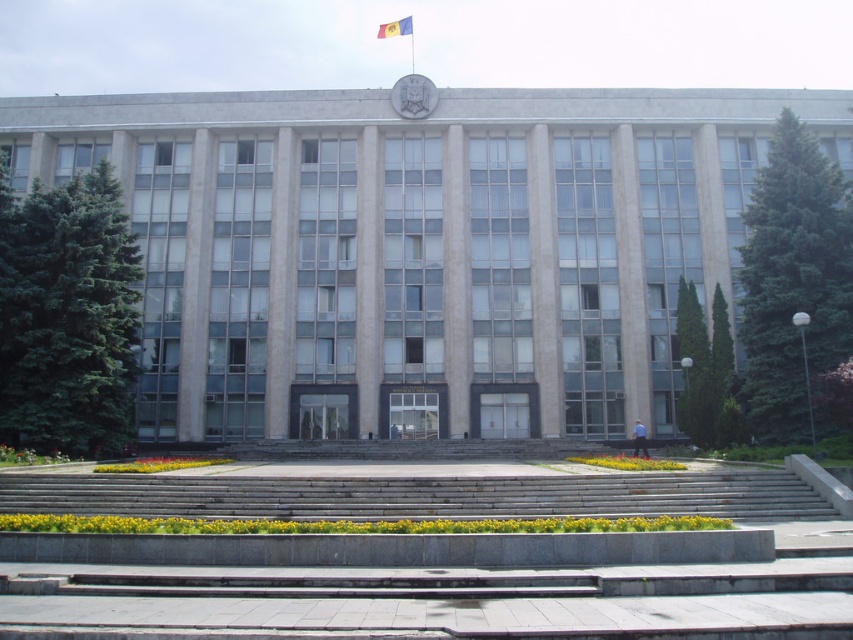
Is point (401, 483) farther from viewer compared to point (381, 26)?

No, it is not.

Can you confirm if gray concrete stairs at center is positioned to the right of blue fabric flag at upper center?

Indeed, gray concrete stairs at center is positioned on the right side of blue fabric flag at upper center.

Where is `gray concrete stairs at center`? Image resolution: width=853 pixels, height=640 pixels. gray concrete stairs at center is located at coordinates (418, 496).

Find the location of a particular element. The width and height of the screenshot is (853, 640). gray concrete stairs at center is located at coordinates [418, 496].

Is matte gray emblem at center shorter than blue fabric flag at upper center?

Yes.

Who is more forward, [427,90] or [395,29]?

Point [427,90]

The image size is (853, 640). I want to click on matte gray emblem at center, so click(413, 97).

You are a GUI agent. You are given a task and a screenshot of the screen. Output one action in this format:
    pyautogui.click(x=<x>, y=<y>)
    Task: Click on the gray concrete stairs at center
    
    Given the screenshot: What is the action you would take?
    pyautogui.click(x=418, y=496)

Does gray concrete stairs at center have a smaller size compared to matte gray emblem at center?

No.

What do you see at coordinates (418, 496) in the screenshot? The height and width of the screenshot is (640, 853). I see `gray concrete stairs at center` at bounding box center [418, 496].

You are a GUI agent. You are given a task and a screenshot of the screen. Output one action in this format:
    pyautogui.click(x=<x>, y=<y>)
    Task: Click on the gray concrete stairs at center
    
    Given the screenshot: What is the action you would take?
    pyautogui.click(x=418, y=496)